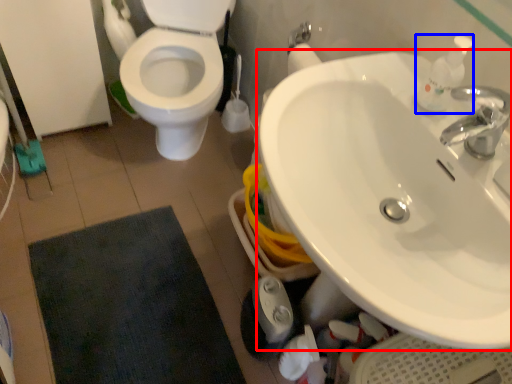
Question: Which of the following is the closest to the observer, sink (highlighted by a red box) or soap dispenser (highlighted by a blue box)?

Choices:
 (A) sink
 (B) soap dispenser

Answer: (A)